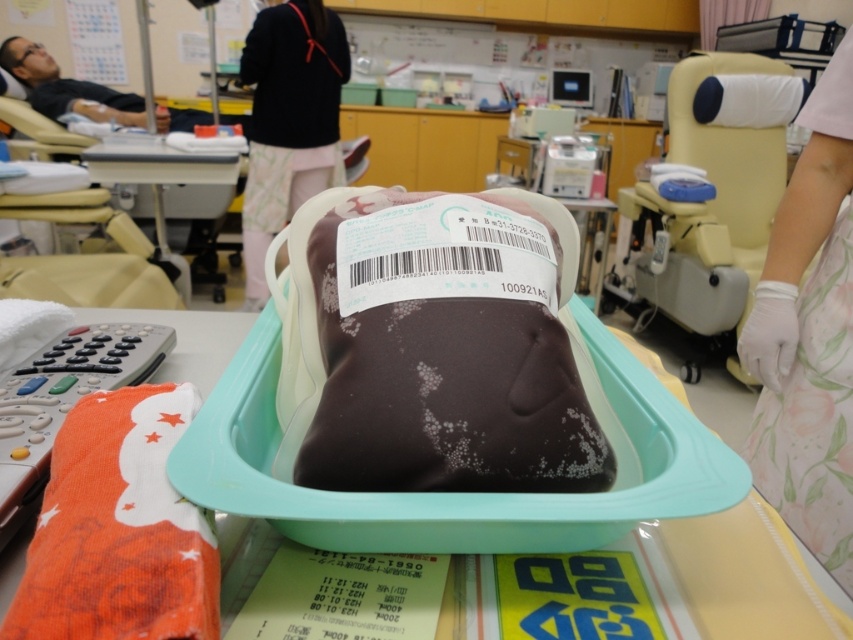
You are a medical technician in the room and need to access both the black fabric at upper center and the matte black person at upper left. Which object is closer to you?

The black fabric at upper center is closer to the viewer than the matte black person at upper left, so you can access it first.

You are a medical assistant who needs to move a tray from the black fabric at upper center to the matte black person at upper left. The tray is 28 inches wide. Can you safely move the tray without hitting anything?

The distance between the black fabric at upper center and the matte black person at upper left is 30.35 inches, so yes, the tray can be moved safely as its width of 28 inches is less than the available space.